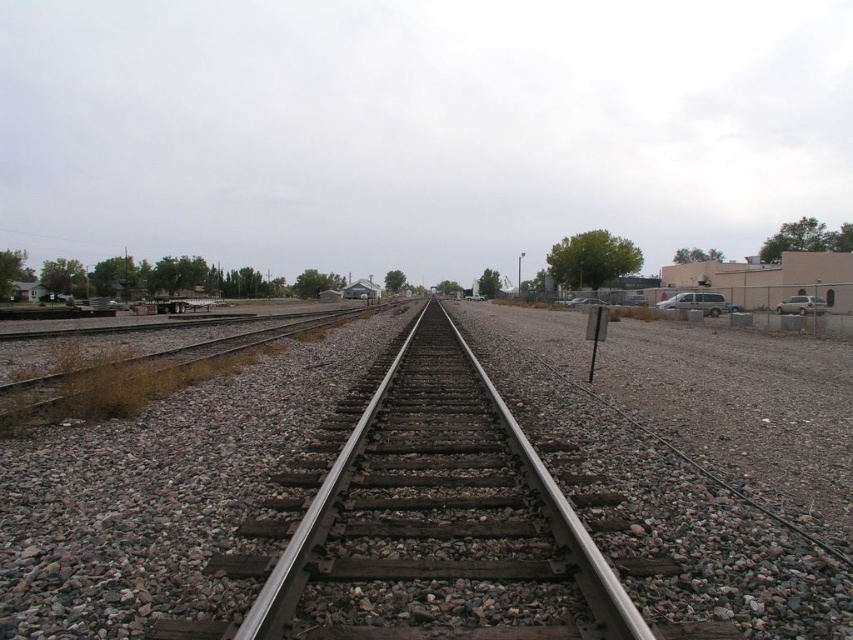
You are standing at the point labeled point (82, 600). You want to walk straight ahead along the railway tracks. How far will you have to walk before you reach the point where the tracks converge into the distance?

The point labeled point (82, 600) is 6.62 meters away from the point where the tracks converge into the distance. So you will have to walk 6.62 meters forward to reach that point.